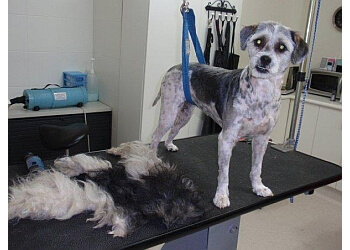
Locate an element on the screen. Image resolution: width=350 pixels, height=250 pixels. stool is located at coordinates (67, 134), (66, 150).